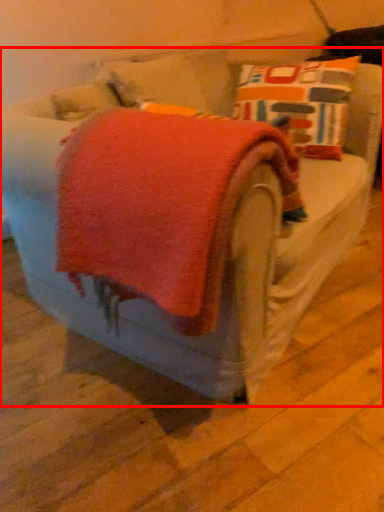
Question: From the image's perspective, what is the correct spatial positioning of furniture (annotated by the red box) in reference to bath towel?

Choices:
 (A) above
 (B) below

Answer: (B)